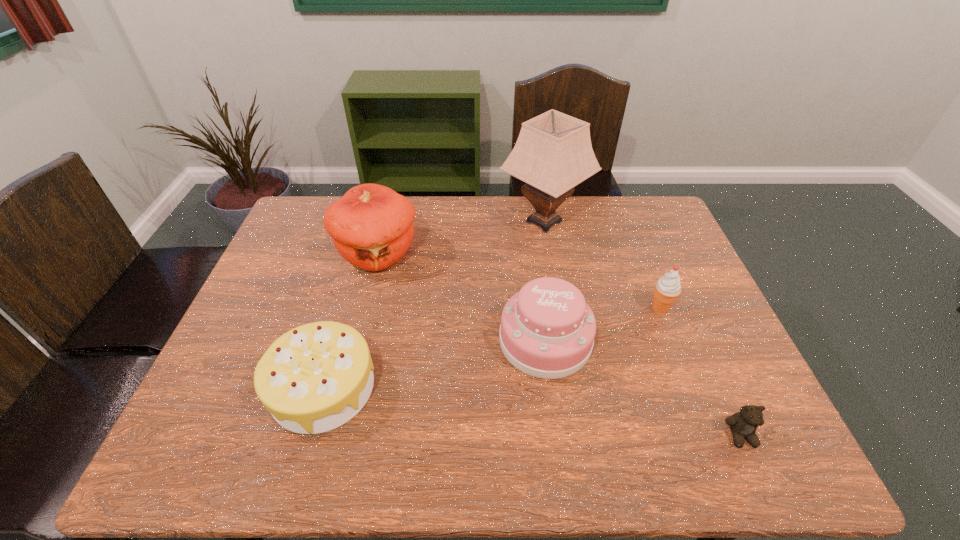
Identify the location of free space between the teddy bear and the right birthday cake. The image size is (960, 540). (643, 388).

Where is `empty space that is in between the tallest object and the teddy bear`? The width and height of the screenshot is (960, 540). empty space that is in between the tallest object and the teddy bear is located at coordinates (642, 328).

Where is `vacant area that lies between the shortest object and the right birthday cake`? vacant area that lies between the shortest object and the right birthday cake is located at coordinates (x=643, y=388).

Where is `free space between the fifth shortest object and the icecream`? free space between the fifth shortest object and the icecream is located at coordinates (519, 281).

Image resolution: width=960 pixels, height=540 pixels. In order to click on unoccupied position between the icecream and the left birthday cake in this screenshot , I will do click(492, 348).

Identify the location of vacant area that lies between the pumpkin and the left birthday cake. 350,320.

Identify the location of object that is the fourth nearest to the icecream. (371, 226).

Find the location of a particular element. This screenshot has height=540, width=960. the fourth closest object to the right birthday cake is located at coordinates (743, 424).

Where is `vacant area that satisfies the following two spatial constraints: 1. on the back side of the left birthday cake; 2. on the right side of the fifth shortest object`? vacant area that satisfies the following two spatial constraints: 1. on the back side of the left birthday cake; 2. on the right side of the fifth shortest object is located at coordinates (362, 253).

Where is `vacant space that satisfies the following two spatial constraints: 1. on the back side of the tallest object; 2. on the right side of the fifth shortest object`? vacant space that satisfies the following two spatial constraints: 1. on the back side of the tallest object; 2. on the right side of the fifth shortest object is located at coordinates (386, 222).